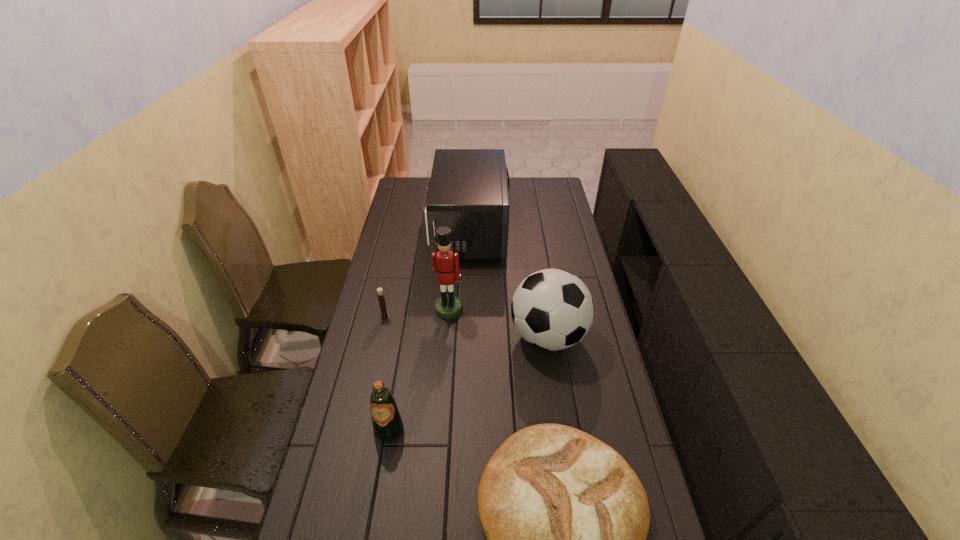
Where is `free space that satisfies the following two spatial constraints: 1. on the front-facing side of the farthest object; 2. on the front side of the leftmost object`? This screenshot has height=540, width=960. free space that satisfies the following two spatial constraints: 1. on the front-facing side of the farthest object; 2. on the front side of the leftmost object is located at coordinates (468, 316).